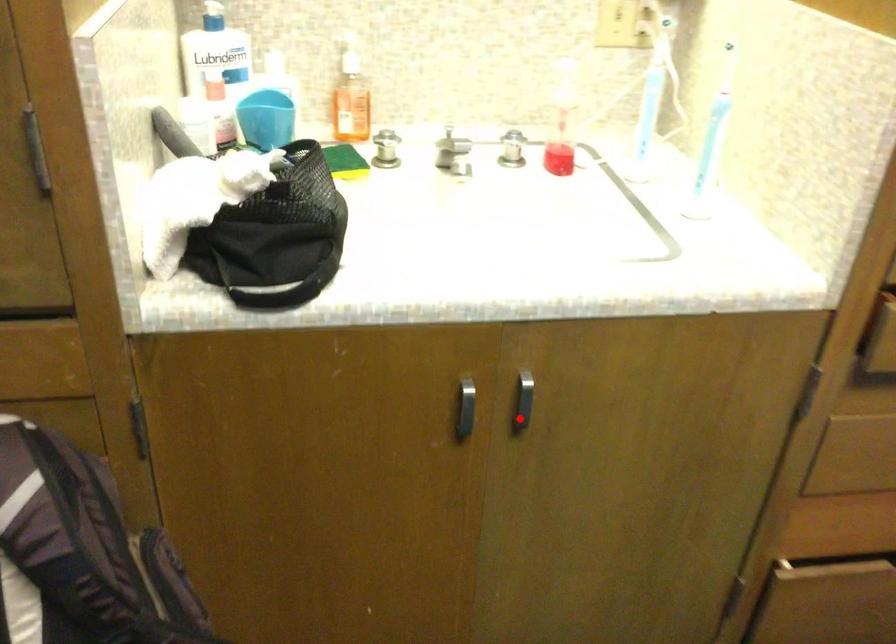
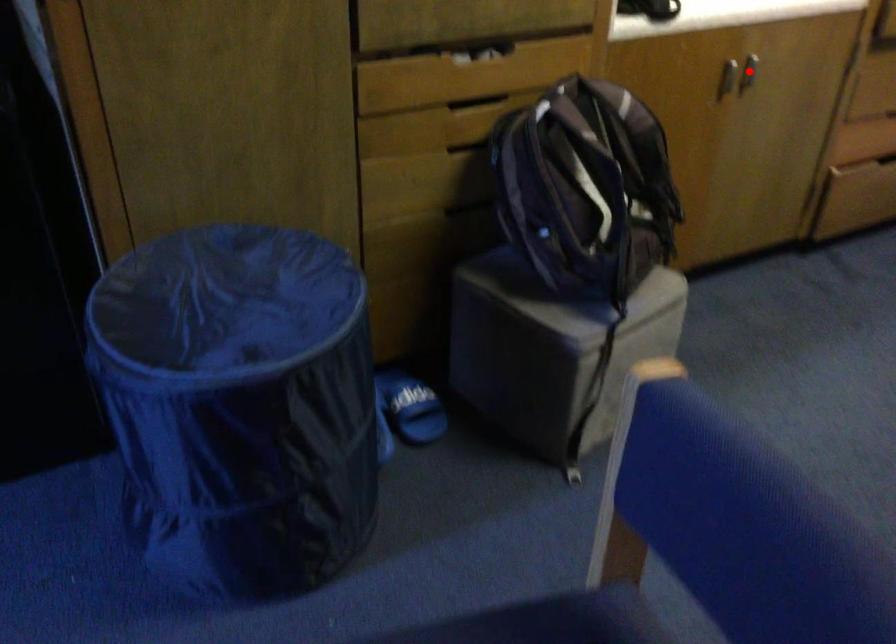
I am providing you with two images of the same scene from different viewpoints. A red point is marked on the first image and another point is marked on the second image. Does the point marked in image1 correspond to the same location as the one in image2?

Yes